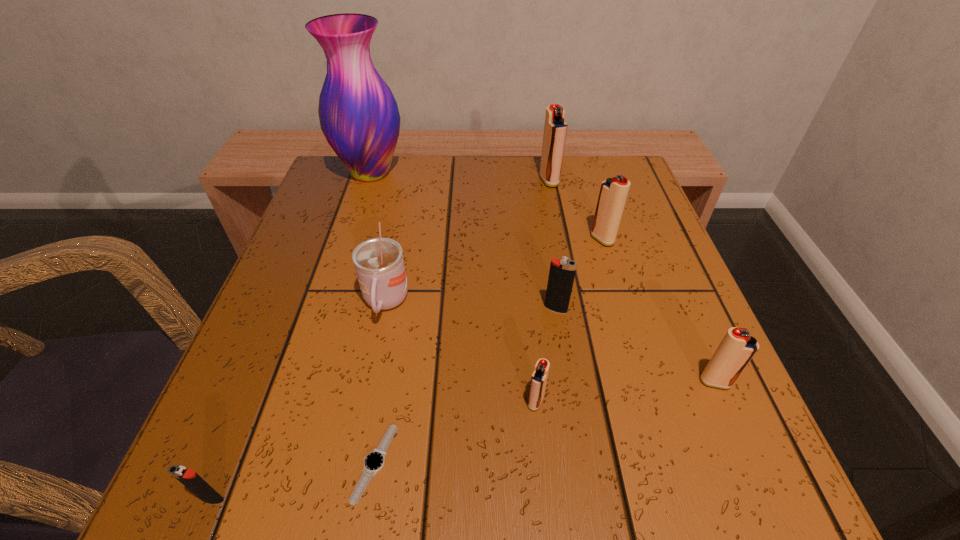
Identify the location of vase. (359, 117).

Where is `purple vase`? The height and width of the screenshot is (540, 960). purple vase is located at coordinates (359, 117).

Where is `the farthest red igniter`? This screenshot has width=960, height=540. the farthest red igniter is located at coordinates (555, 128).

Identify the location of the farthest igniter. Image resolution: width=960 pixels, height=540 pixels. (555, 128).

Where is `the third nearest red igniter`? Image resolution: width=960 pixels, height=540 pixels. the third nearest red igniter is located at coordinates (613, 193).

You are a GUI agent. You are given a task and a screenshot of the screen. Output one action in this format:
    pyautogui.click(x=<x>, y=<y>)
    Task: Click on the second object from right to left
    
    Given the screenshot: What is the action you would take?
    pyautogui.click(x=613, y=193)

Locate an element on the screen. cup is located at coordinates (379, 264).

This screenshot has height=540, width=960. Find the location of `the third farthest igniter`. the third farthest igniter is located at coordinates (562, 272).

The image size is (960, 540). I want to click on the bigger black igniter, so click(562, 272).

Where is `the rightmost red igniter`? the rightmost red igniter is located at coordinates (737, 348).